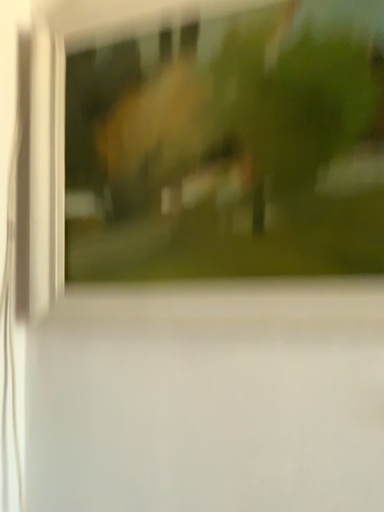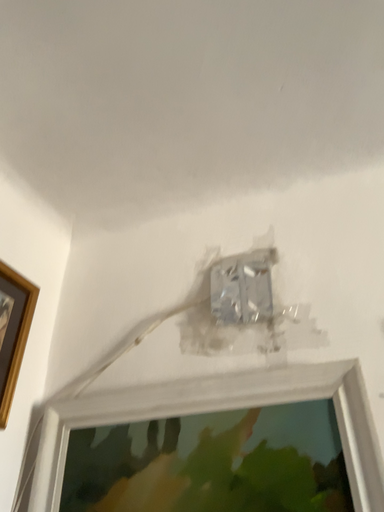
Question: Which way did the camera rotate in the video?

Choices:
 (A) rotated upward
 (B) rotated downward

Answer: (A)